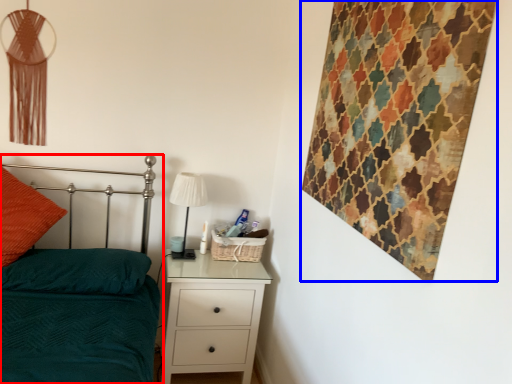
Question: Which object is closer to the camera taking this photo, bed (highlighted by a red box) or tapestry (highlighted by a blue box)?

Choices:
 (A) bed
 (B) tapestry

Answer: (A)